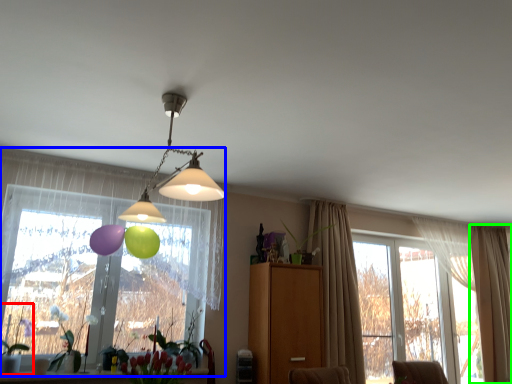
Question: Which is nearer to the plant (highlighted by a red box)? window (highlighted by a blue box) or curtain (highlighted by a green box).

Choices:
 (A) window
 (B) curtain

Answer: (A)